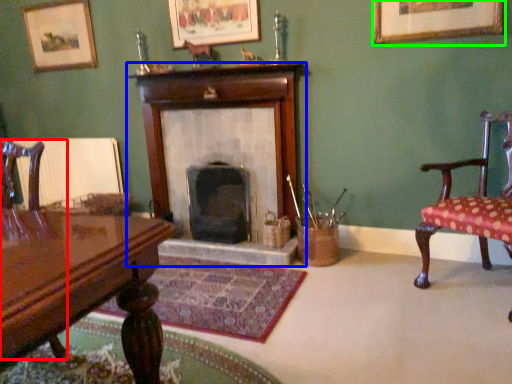
Question: Based on their relative distances, which object is farther from chair (highlighted by a red box)? Choose from fireplace (highlighted by a blue box) and picture frame (highlighted by a green box).

Choices:
 (A) fireplace
 (B) picture frame

Answer: (B)